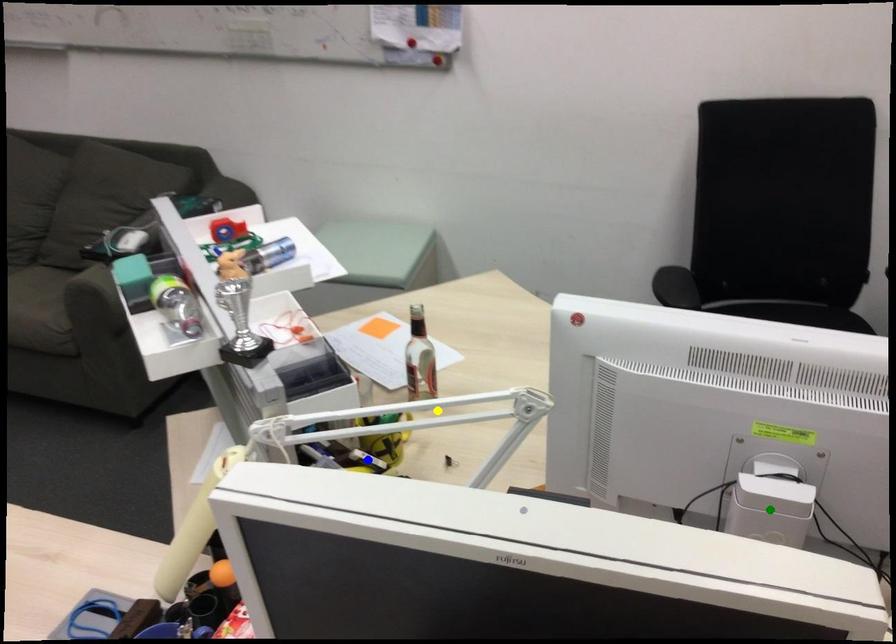
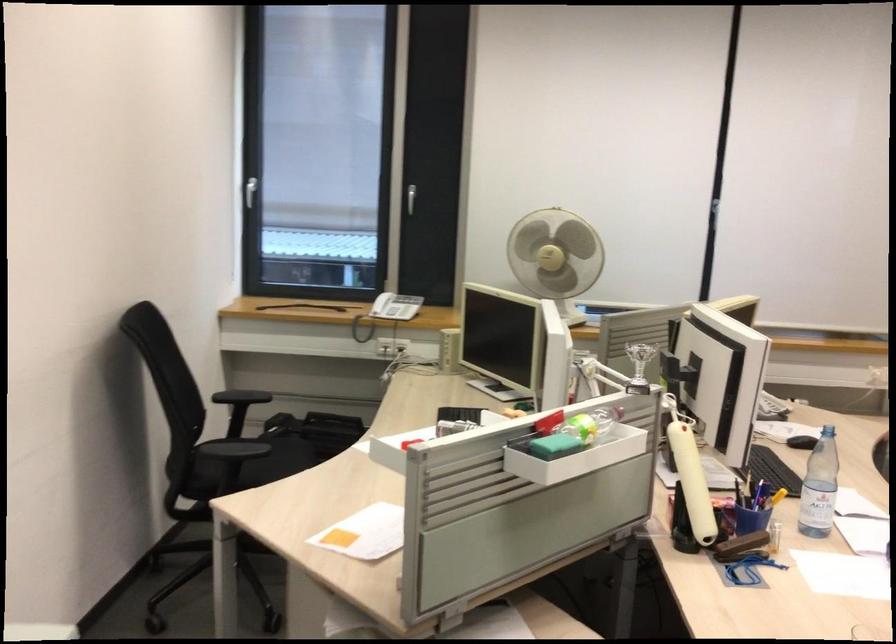
I am providing you with two images of the same scene from different viewpoints. Three points are marked in image1. Which point corresponds to a part or object that is occluded in image2?In image1, three points are marked. Which of them correspond to a part or object that is occluded in image2?Among the three points shown in image1, which one corresponds to a part or object that is no longer visible due to occlusion in image2?

blue point, yellow point, green point